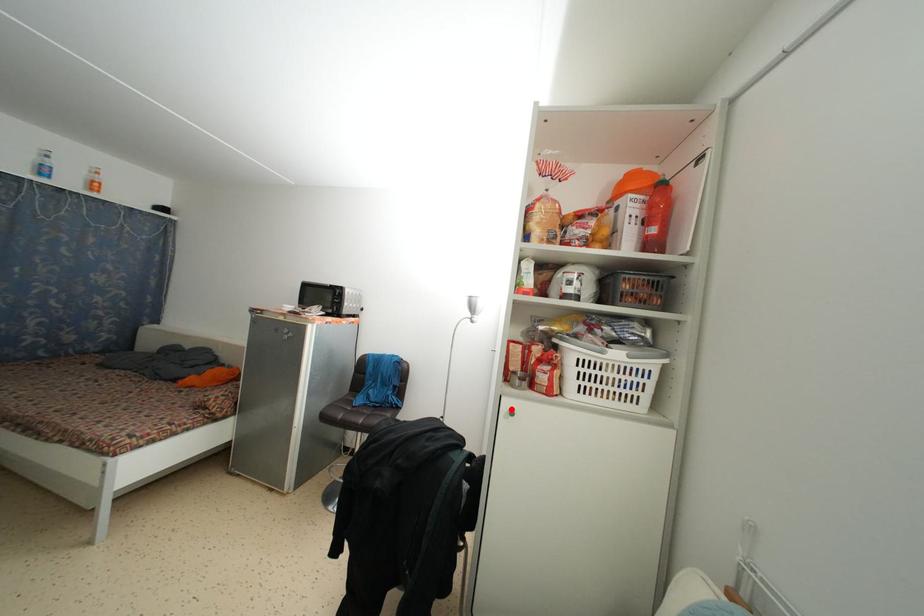
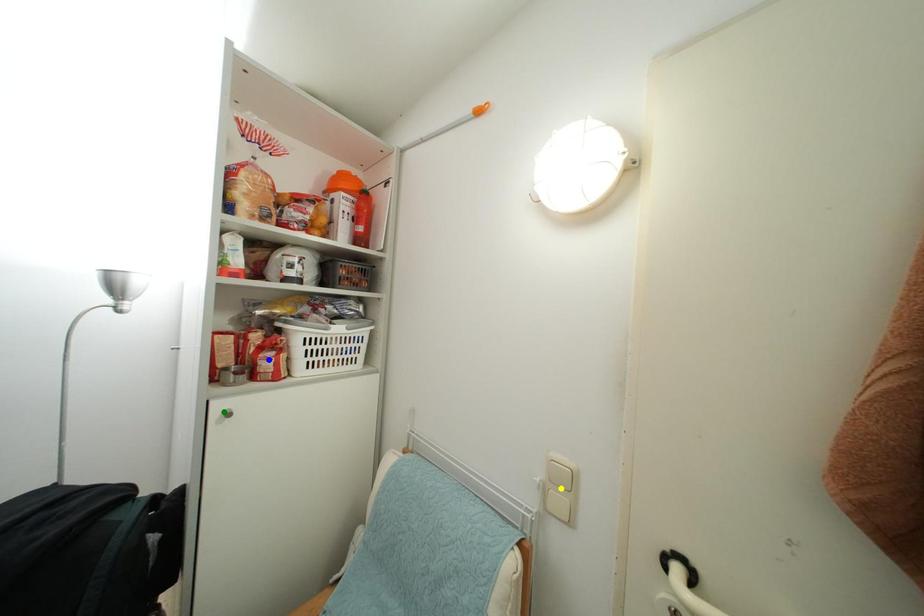
Question: I am providing you with two images of the same scene from different viewpoints. A red point is marked on the first image. You are given multiple points on the second image. Which point in image 2 represents the same 3d spot as the red point in image 1?

Choices:
 (A) yellow point
 (B) blue point
 (C) green point

Answer: (C)